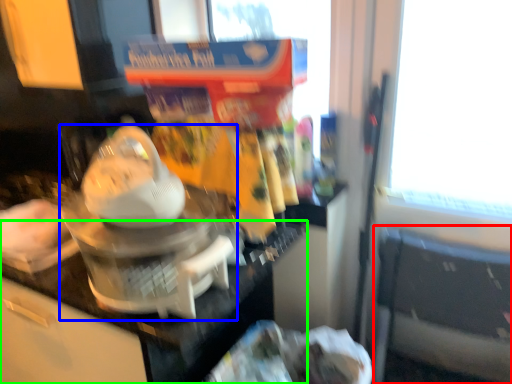
Question: Based on their relative distances, which object is nearer to chair (highlighted by a red box)? Choose from kitchen appliance (highlighted by a blue box) and counter top (highlighted by a green box).

Choices:
 (A) kitchen appliance
 (B) counter top

Answer: (B)